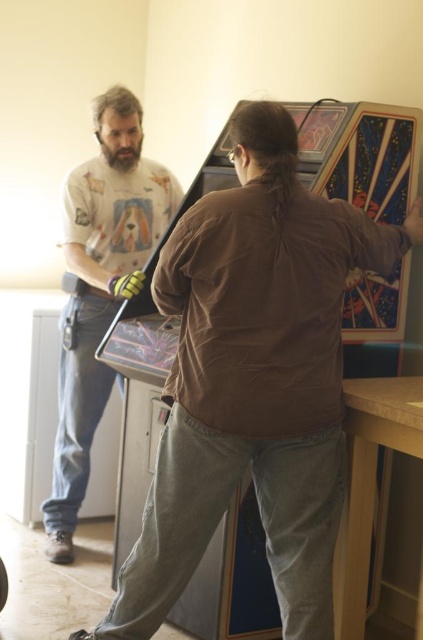
Question: Is brown matte shirt at center above white t-shirt with dog print at left?

Choices:
 (A) yes
 (B) no

Answer: (B)

Question: Which of the following is the farthest from the observer?

Choices:
 (A) (323, 529)
 (B) (109, 262)

Answer: (B)

Question: Which point is closer to the camera?

Choices:
 (A) (227, 256)
 (B) (96, 109)

Answer: (A)

Question: Is brown matte shirt at center thinner than white t-shirt with dog print at left?

Choices:
 (A) no
 (B) yes

Answer: (A)

Question: Does brown matte shirt at center have a lesser width compared to white t-shirt with dog print at left?

Choices:
 (A) no
 (B) yes

Answer: (A)